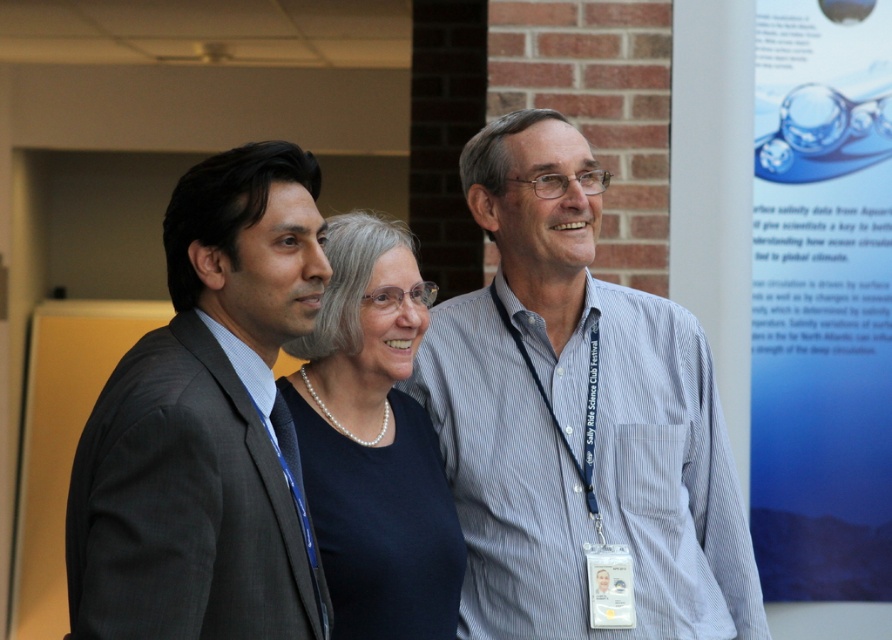
Who is more forward, (504, 488) or (259, 326)?

Positioned in front is point (259, 326).

Between white striped shirt at center and dark gray suit at left, which one has more height?

white striped shirt at center

Does point (701, 397) come in front of point (164, 481)?

That is False.

Locate an element on the screen. Image resolution: width=892 pixels, height=640 pixels. white striped shirt at center is located at coordinates (577, 417).

Describe the element at coordinates (207, 424) in the screenshot. I see `dark gray suit at left` at that location.

Is dark gray suit at left further to camera compared to pearl necklace at center?

No, dark gray suit at left is in front of pearl necklace at center.

Locate an element on the screen. dark gray suit at left is located at coordinates (207, 424).

Image resolution: width=892 pixels, height=640 pixels. Identify the location of dark gray suit at left. (207, 424).

Can you confirm if dark gray suit at left is thinner than blue paper at upper right?

Yes, dark gray suit at left is thinner than blue paper at upper right.

Does dark gray suit at left appear on the left side of blue paper at upper right?

Yes, dark gray suit at left is to the left of blue paper at upper right.

Describe the element at coordinates (207, 424) in the screenshot. The image size is (892, 640). I see `dark gray suit at left` at that location.

Where is `dark gray suit at left`? dark gray suit at left is located at coordinates (207, 424).